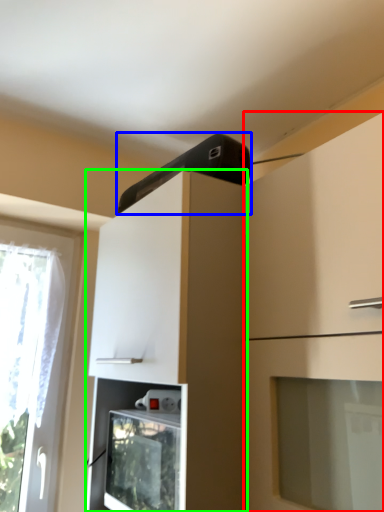
Question: Which object is positioned farthest from cabinetry (highlighted by a red box)? Select from appliance (highlighted by a blue box) and cabinetry (highlighted by a green box).

Choices:
 (A) appliance
 (B) cabinetry

Answer: (A)